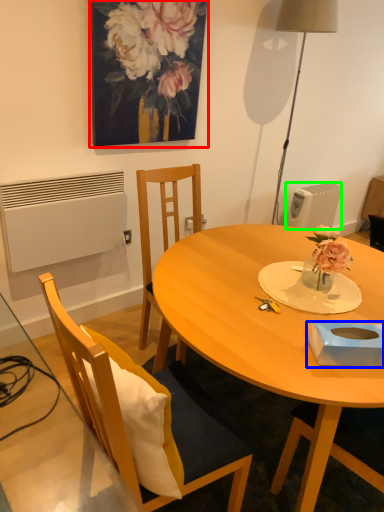
Question: Which object is positioned farthest from picture frame (highlighted by a red box)? Select from box (highlighted by a blue box) and radiator (highlighted by a green box).

Choices:
 (A) box
 (B) radiator

Answer: (A)